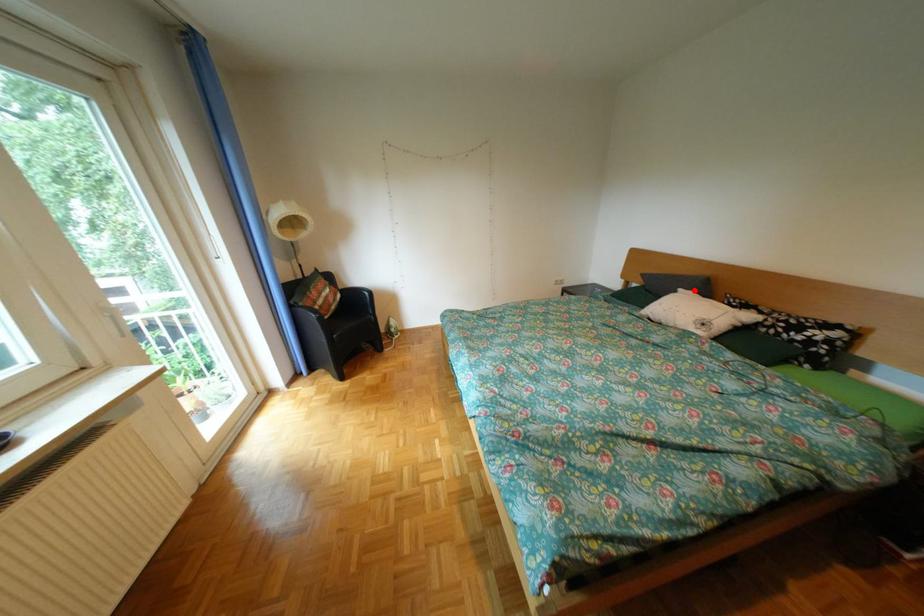
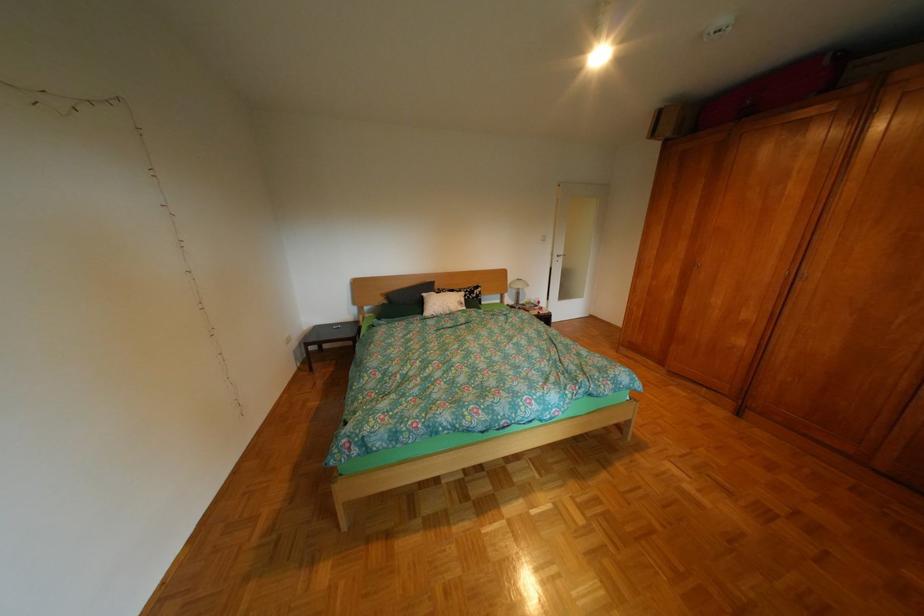
Find the pixel in the second image that matches the highlighted location in the first image.

(439, 294)